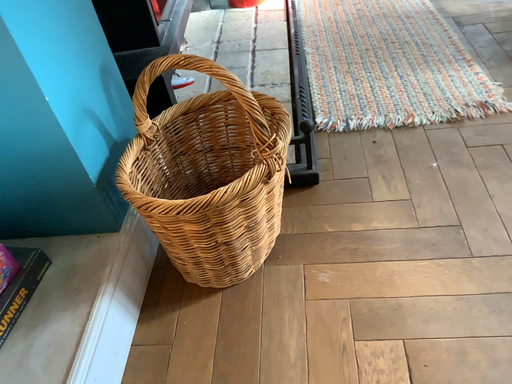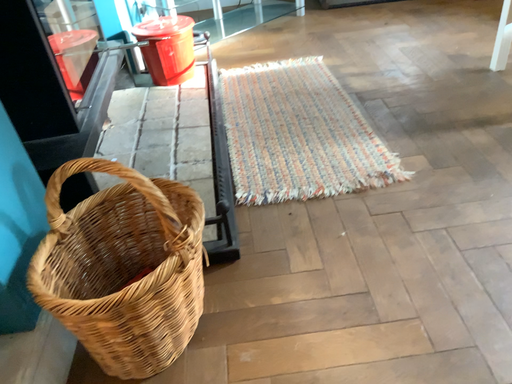
Question: Which way did the camera rotate in the video?

Choices:
 (A) rotated left
 (B) rotated right

Answer: (B)